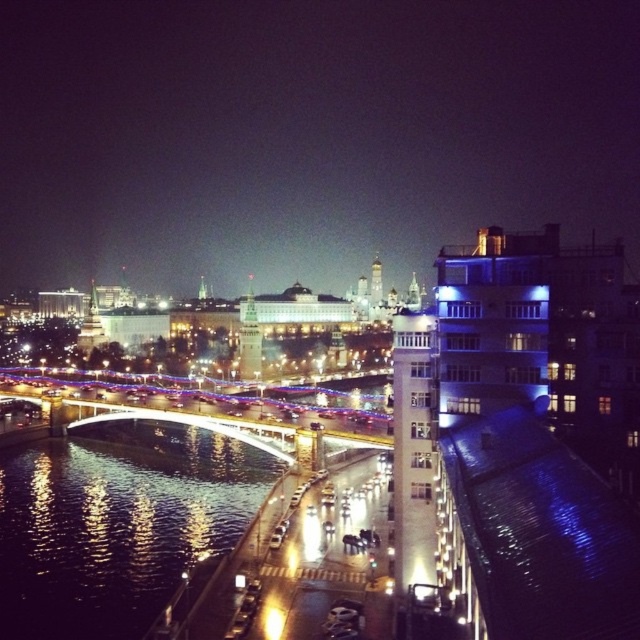
Is gold textured tower at center to the left of white marble tower at center from the viewer's perspective?

Correct, you'll find gold textured tower at center to the left of white marble tower at center.

Who is more forward, [248,301] or [376,288]?

Point [248,301]

You are a GUI agent. You are given a task and a screenshot of the screen. Output one action in this format:
    pyautogui.click(x=<x>, y=<y>)
    Task: Click on the gold textured tower at center
    
    Given the screenshot: What is the action you would take?
    pyautogui.click(x=250, y=339)

Describe the element at coordinates (305, 136) in the screenshot. The width and height of the screenshot is (640, 640). I see `reflective glass bridge at center` at that location.

Does reflective glass bridge at center have a smaller size compared to white marble tower at center?

No.

Is point (580, 61) more distant than point (378, 280)?

Yes, point (580, 61) is farther from viewer.

Image resolution: width=640 pixels, height=640 pixels. What are the coordinates of `reflective glass bridge at center` in the screenshot? It's located at (305, 136).

Which is more to the left, glossy reflective water at lower left or white marble tower at center?

glossy reflective water at lower left is more to the left.

Which is in front, point (128, 433) or point (374, 294)?

Positioned in front is point (128, 433).

In order to click on glossy reflective water at lower left in this screenshot , I will do [116, 524].